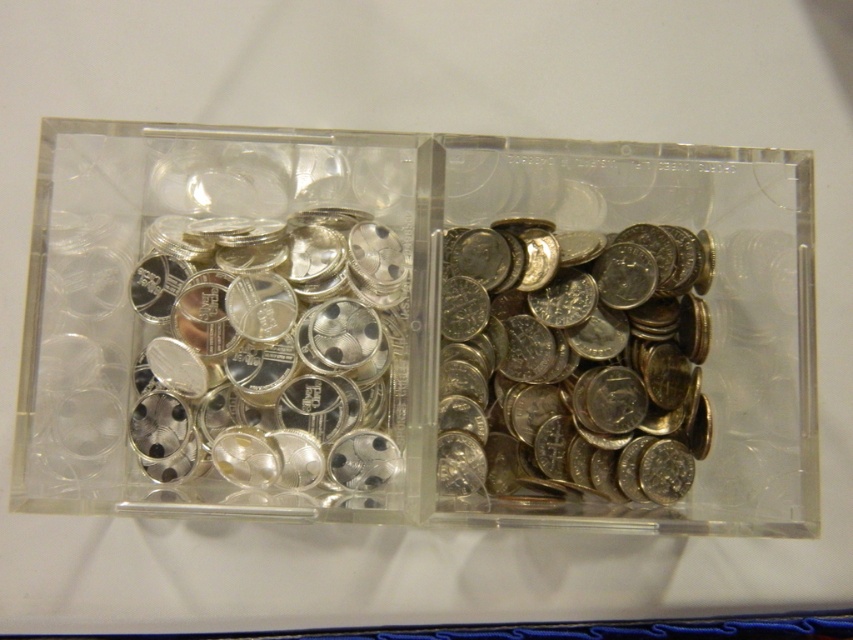
How much distance is there between shiny metallic coins at center and silver shiny coins at center?

They are 3.38 inches apart.

Who is shorter, shiny metallic coins at center or silver shiny coins at center?

With less height is silver shiny coins at center.

Does point (611, 481) come behind point (219, 282)?

Yes, point (611, 481) is behind point (219, 282).

The height and width of the screenshot is (640, 853). I want to click on shiny metallic coins at center, so click(573, 362).

Is transparent plastic coins at center below shiny metallic coins at center?

No, transparent plastic coins at center is not below shiny metallic coins at center.

Does point (131, 419) come closer to viewer compared to point (590, 396)?

Yes, point (131, 419) is closer to viewer.

Find the location of a particular element. transparent plastic coins at center is located at coordinates (418, 330).

Is transparent plastic coins at center behind silver shiny coins at center?

No, it is not.

Does transparent plastic coins at center appear under silver shiny coins at center?

Incorrect, transparent plastic coins at center is not positioned below silver shiny coins at center.

Is point (590, 401) less distant than point (273, 483)?

No, (590, 401) is behind (273, 483).

Where is `transparent plastic coins at center`? The width and height of the screenshot is (853, 640). transparent plastic coins at center is located at coordinates (418, 330).